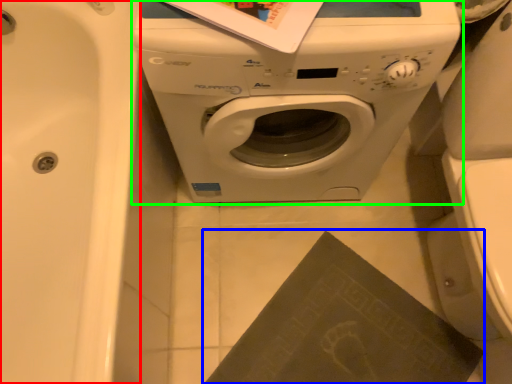
Question: Which object is the closest to the bath (highlighted by a red box)? Choose among these: paperback book (highlighted by a blue box) or washing machine (highlighted by a green box).

Choices:
 (A) paperback book
 (B) washing machine

Answer: (B)